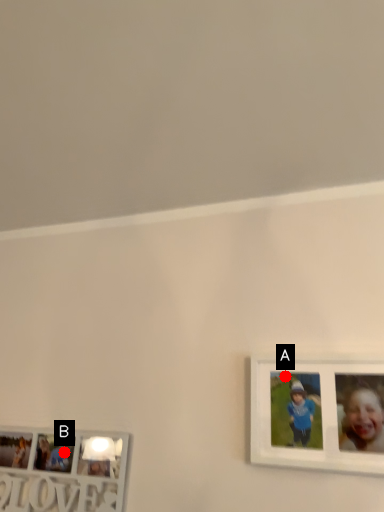
Question: Two points are circled on the image, labeled by A and B beside each circle. Which point is closer to the camera?

Choices:
 (A) A is closer
 (B) B is closer

Answer: (A)